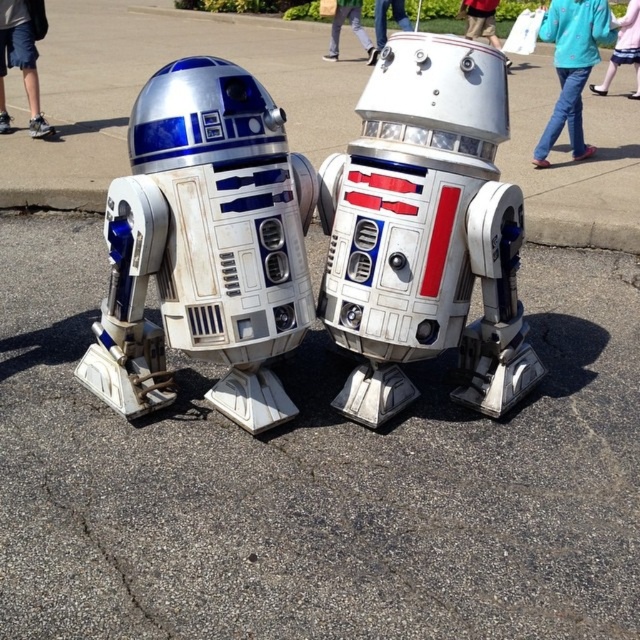
Question: Which of the following is the farthest from the observer?

Choices:
 (A) (385, 33)
 (B) (480, 26)
 (C) (634, 4)
 (D) (20, 51)

Answer: (A)

Question: Does blue fabric dress at upper center have a greater width compared to white plastic head at center?

Choices:
 (A) no
 (B) yes

Answer: (B)

Question: Where is brushed metal shorts at left located in relation to white plastic head at center in the image?

Choices:
 (A) below
 (B) above

Answer: (A)

Question: Can you confirm if blue jeans at upper right is smaller than blue fabric pants at center?

Choices:
 (A) no
 (B) yes

Answer: (B)

Question: Which object appears closest to the camera in this image?

Choices:
 (A) white plastic head at center
 (B) brushed metal shorts at left
 (C) blue fabric pants at upper center

Answer: (B)

Question: Estimate the real-world distances between objects in this image. Which object is farther from the brushed metal shorts at left?

Choices:
 (A) blue fabric pants at upper center
 (B) white plastic head at center

Answer: (B)